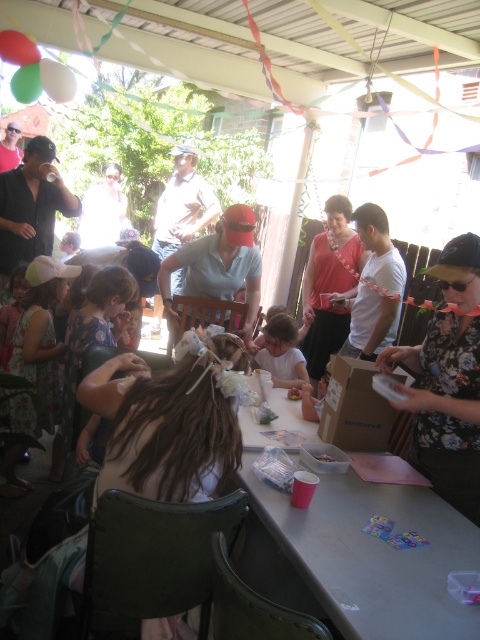
You are a guest at the party and want to sit down. There is a gray plastic table at center and a light blue shirt at center. Which one is closer to you?

The gray plastic table at center is closer to you since it is in front of the light blue shirt at center.

You are standing at the entrance of the covered patio area and want to find the gray plastic table at center. According to the coordinate system where the bottom left corner is the origin, which direction should you move to reach it?

The gray plastic table at center is located at coordinate point 0.869 on the x axis and 0.746 on the y axis. Since the origin is at the bottom left corner, you should move towards the upper right direction to reach the gray plastic table at center.